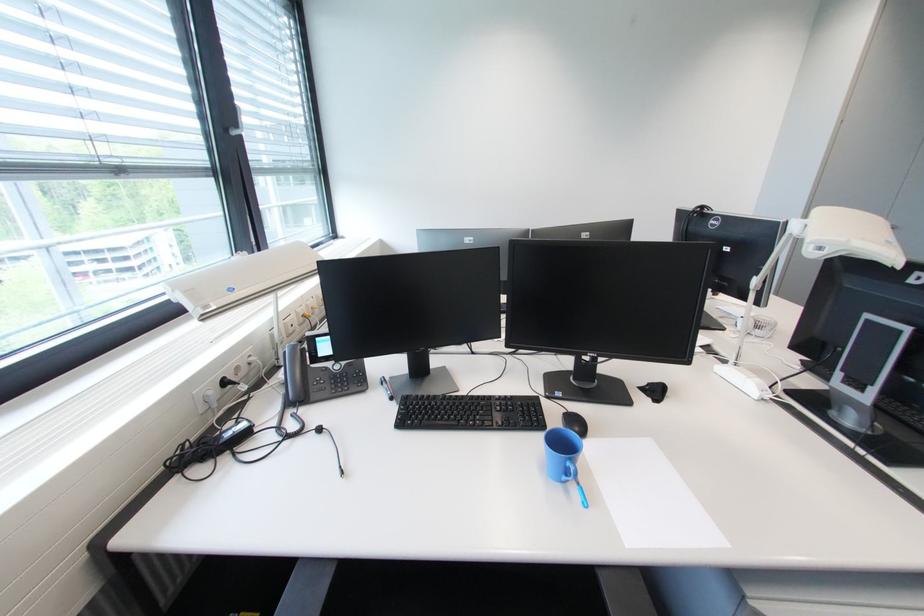
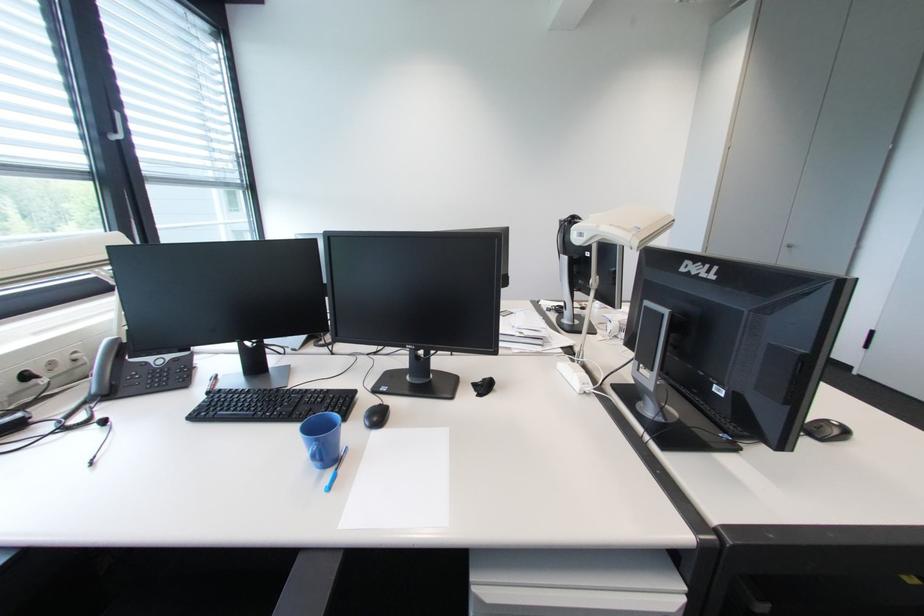
Question: How did the camera likely rotate?

Choices:
 (A) Left
 (B) Right
 (C) Up
 (D) Down

Answer: (C)